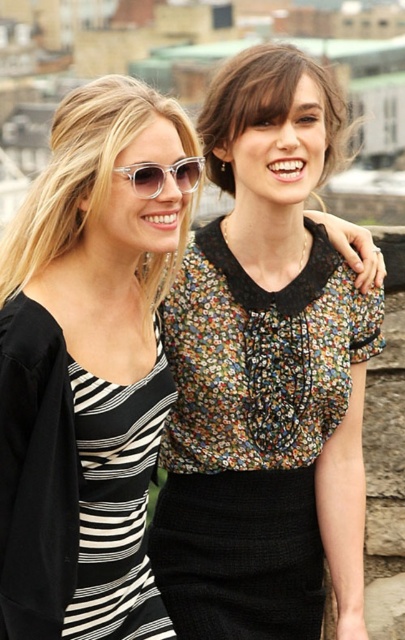
In the scene shown: Is floral fabric blouse at center to the right of clear acetate sunglasses at upper center from the viewer's perspective?

Yes, floral fabric blouse at center is to the right of clear acetate sunglasses at upper center.

Does floral fabric blouse at center appear over clear acetate sunglasses at upper center?

No, floral fabric blouse at center is not above clear acetate sunglasses at upper center.

Who is more distant from viewer, (319, 241) or (155, 180)?

Positioned behind is point (319, 241).

Locate an element on the screen. The width and height of the screenshot is (405, 640). floral fabric blouse at center is located at coordinates (251, 436).

Can you confirm if floral fabric blouse at center is positioned to the left of floral fabric blouse at upper center?

Correct, you'll find floral fabric blouse at center to the left of floral fabric blouse at upper center.

Can you confirm if floral fabric blouse at center is smaller than floral fabric blouse at upper center?

Indeed, floral fabric blouse at center has a smaller size compared to floral fabric blouse at upper center.

Measure the distance between floral fabric blouse at center and camera.

floral fabric blouse at center and camera are 34.86 meters apart.

Find the location of `floral fabric blouse at center`. floral fabric blouse at center is located at coordinates [x=251, y=436].

Who is higher up, floral fabric blouse at upper center or clear acetate sunglasses at upper center?

floral fabric blouse at upper center

Does floral fabric blouse at upper center have a greater height compared to clear acetate sunglasses at upper center?

Correct, floral fabric blouse at upper center is much taller as clear acetate sunglasses at upper center.

Does point (249, 49) come behind point (149, 161)?

That is True.

The height and width of the screenshot is (640, 405). In order to click on floral fabric blouse at upper center in this screenshot , I will do `click(266, 106)`.